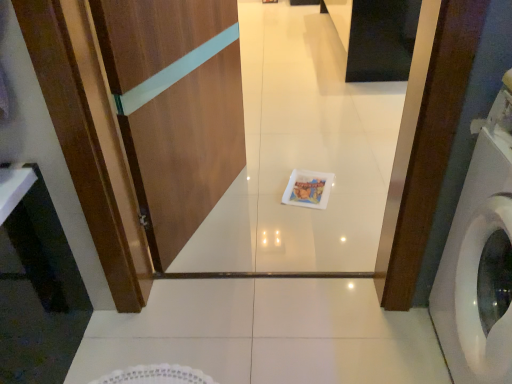
I want to click on vacant area that is in front of wooden screen door at center, so 232,243.